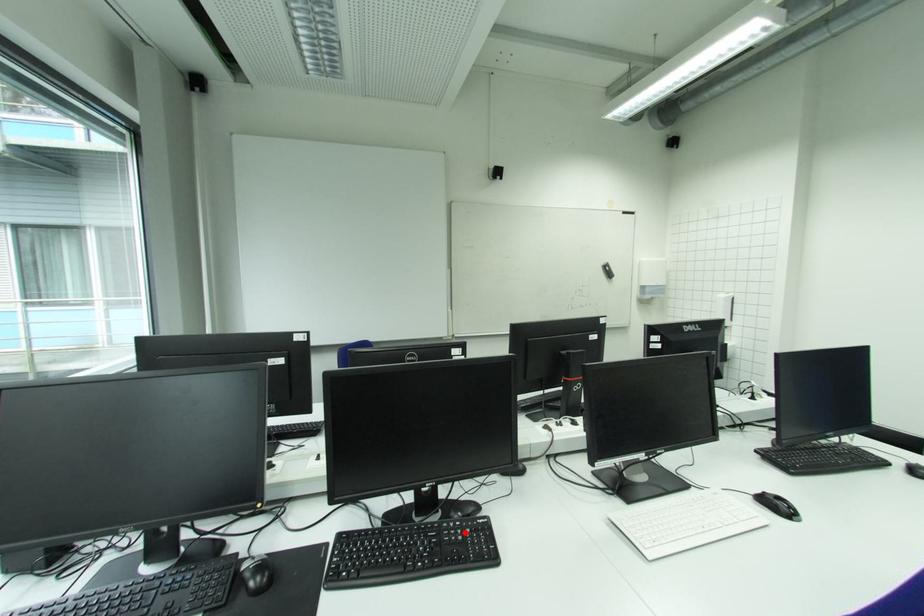
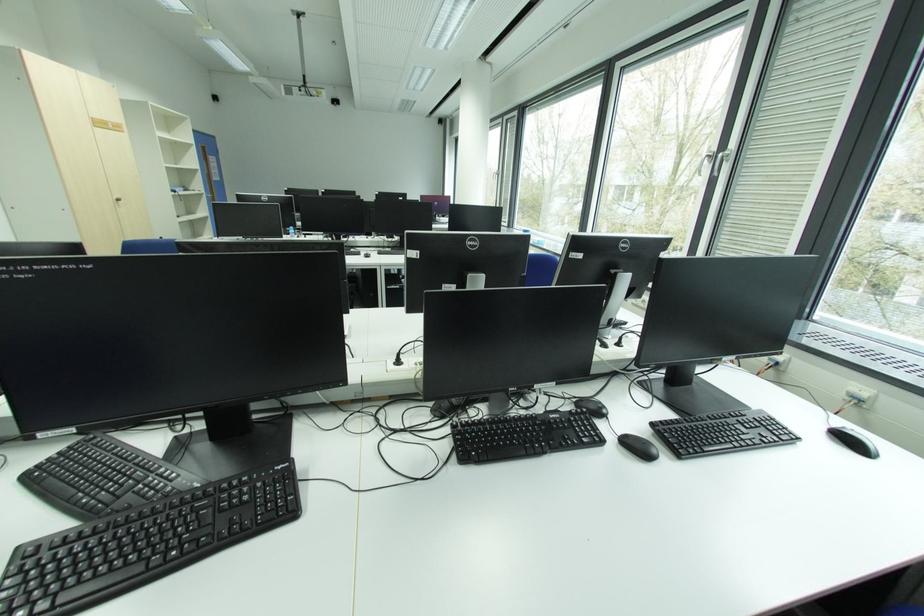
Question: I am providing you with two images of the same scene from different viewpoints. A red point is marked on the first image. Can you still see the location of the red point in image 2?

Choices:
 (A) Yes
 (B) No

Answer: (B)